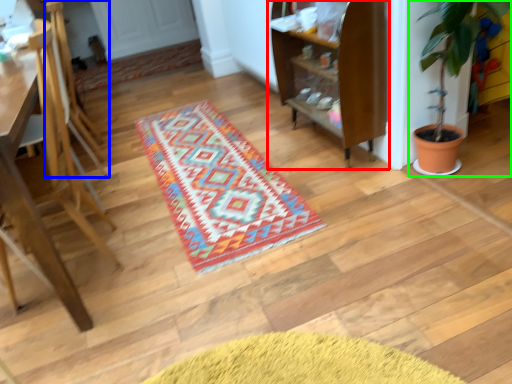
Question: Based on their relative distances, which object is nearer to shelf (highlighted by a red box)? Choose from armchair (highlighted by a blue box) and houseplant (highlighted by a green box).

Choices:
 (A) armchair
 (B) houseplant

Answer: (B)